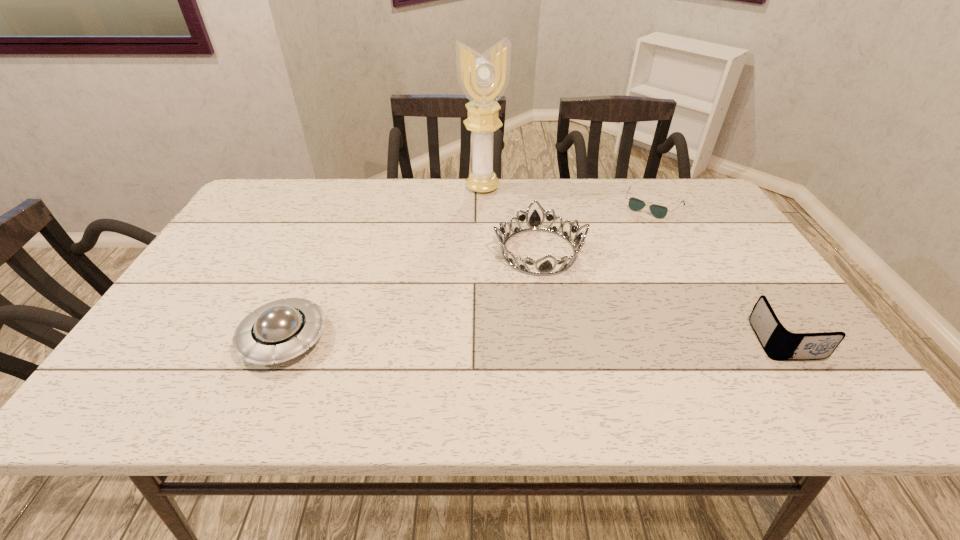
This screenshot has width=960, height=540. I want to click on vacant spot on the desktop that is between the saucer and the wallet and is positioned on the front-facing side of the third farthest object, so click(559, 340).

At what (x,y) coordinates should I click in order to perform the action: click on free spot on the desktop that is between the saucer and the wallet and is positioned on the front-facing side of the award. Please return your answer as a coordinate pair (x, y). This screenshot has width=960, height=540. Looking at the image, I should click on point(554,340).

This screenshot has width=960, height=540. Identify the location of free spot on the desktop that is between the saucer and the wallet and is positioned on the lenses of the shortest object. (565, 340).